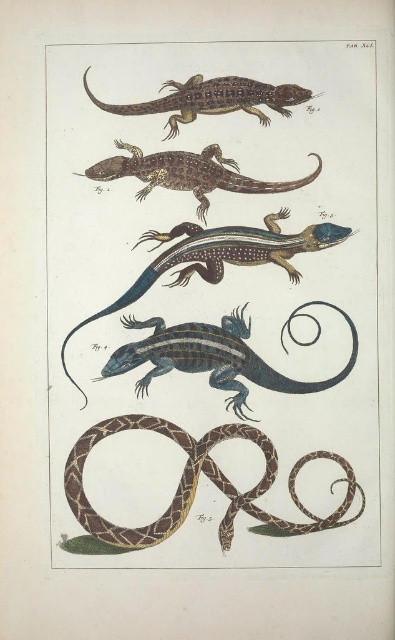
Which of these two, blue glossy lizard at center or shiny blue and black lizard at center, stands taller?

With more height is shiny blue and black lizard at center.

Consider the image. Who is more distant from viewer, [133,323] or [135,292]?

The point [135,292] is behind.

Locate an element on the screen. This screenshot has width=395, height=640. blue glossy lizard at center is located at coordinates (216, 355).

Who is more distant from viewer, (156, 428) or (285, 106)?

Positioned behind is point (285, 106).

Looking at this image, is the position of brown textured snake at center less distant than that of brown textured lizard at upper center?

That is True.

Does point (319, 164) come behind point (203, 113)?

Yes.

Where is `brown textured snake at center`? Image resolution: width=395 pixels, height=640 pixels. brown textured snake at center is located at coordinates (214, 356).

Does point (276, 224) lie behind point (154, 332)?

That is True.

Can you confirm if brown textured snake at center is thinner than blue glossy lizard at center?

Correct, brown textured snake at center's width is less than blue glossy lizard at center's.

Does point (319, 301) come behind point (242, 324)?

Yes.

Identify the location of brown textured snake at center. (214, 356).